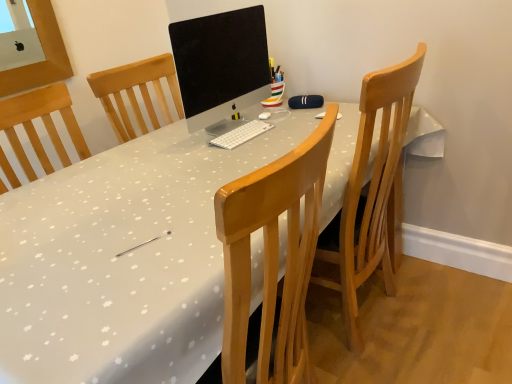
Question: Does matte black monitor at center lie behind white glossy desk at center?

Choices:
 (A) no
 (B) yes

Answer: (B)

Question: Is white glossy desk at center surrounded by matte black monitor at center?

Choices:
 (A) yes
 (B) no

Answer: (B)

Question: Is matte black monitor at center in contact with white glossy desk at center?

Choices:
 (A) no
 (B) yes

Answer: (A)

Question: From a real-world perspective, is matte black monitor at center positioned over white glossy desk at center based on gravity?

Choices:
 (A) yes
 (B) no

Answer: (A)

Question: Does matte black monitor at center have a lesser height compared to white glossy desk at center?

Choices:
 (A) no
 (B) yes

Answer: (B)

Question: Is matte black monitor at center inside or outside of white glossy desk at center?

Choices:
 (A) inside
 (B) outside

Answer: (B)

Question: Visually, is matte black monitor at center positioned to the left or to the right of white glossy desk at center?

Choices:
 (A) left
 (B) right

Answer: (B)

Question: From a real-world perspective, is matte black monitor at center positioned above or below white glossy desk at center?

Choices:
 (A) above
 (B) below

Answer: (A)

Question: Is matte black monitor at center bigger or smaller than white glossy desk at center?

Choices:
 (A) small
 (B) big

Answer: (A)

Question: In the image, is matte black monitor at center on the left side or the right side of light brown wooden chair at center?

Choices:
 (A) right
 (B) left

Answer: (B)

Question: From the image's perspective, is matte black monitor at center located above or below light brown wooden chair at center?

Choices:
 (A) above
 (B) below

Answer: (A)

Question: Considering the positions of matte black monitor at center and light brown wooden chair at center in the image, is matte black monitor at center wider or thinner than light brown wooden chair at center?

Choices:
 (A) thin
 (B) wide

Answer: (A)

Question: In the image, is matte black monitor at center positioned in front of or behind light brown wooden chair at center?

Choices:
 (A) front
 (B) behind

Answer: (B)

Question: Relative to white glossy desk at center, is light brown wooden chair at center in front or behind?

Choices:
 (A) front
 (B) behind

Answer: (B)

Question: Considering the positions of light brown wooden chair at center and white glossy desk at center in the image, is light brown wooden chair at center wider or thinner than white glossy desk at center?

Choices:
 (A) wide
 (B) thin

Answer: (B)